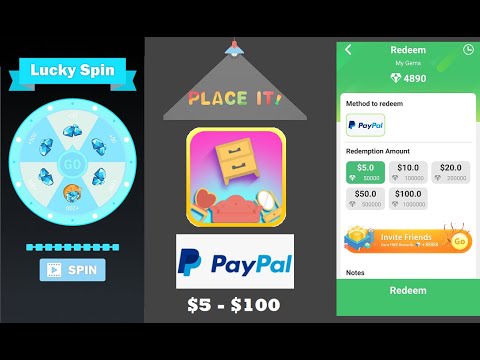
Identify the location of back of sofa. (231, 206), (246, 206).